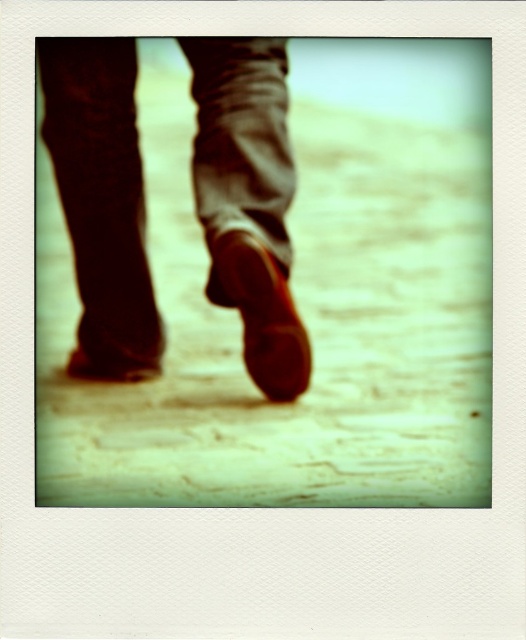
Is point (325, 378) positioned behind point (256, 332)?

Yes.

At what (x,y) coordinates should I click in order to perform the action: click on yellow stone pavement at center. Please return your answer as a coordinate pair (x, y). This screenshot has width=526, height=640. Looking at the image, I should click on (305, 323).

Does yellow stone pavement at center appear over matte brown shoe at center?

Correct, yellow stone pavement at center is located above matte brown shoe at center.

Between yellow stone pavement at center and matte brown shoe at center, which one is positioned higher?

yellow stone pavement at center is above.

Is point (441, 420) farther from viewer compared to point (114, 369)?

No, (441, 420) is closer to viewer.

At what (x,y) coordinates should I click in order to perform the action: click on yellow stone pavement at center. Please return your answer as a coordinate pair (x, y). This screenshot has height=640, width=526. Looking at the image, I should click on (305, 323).

In the scene shown: Measure the distance between matte brown shoe at center and shiny brown shoe at center.

The distance of matte brown shoe at center from shiny brown shoe at center is 5.65 inches.

Is matte brown shoe at center smaller than shiny brown shoe at center?

Actually, matte brown shoe at center might be larger than shiny brown shoe at center.

This screenshot has width=526, height=640. Describe the element at coordinates (248, 198) in the screenshot. I see `matte brown shoe at center` at that location.

Locate an element on the screen. The height and width of the screenshot is (640, 526). matte brown shoe at center is located at coordinates (248, 198).